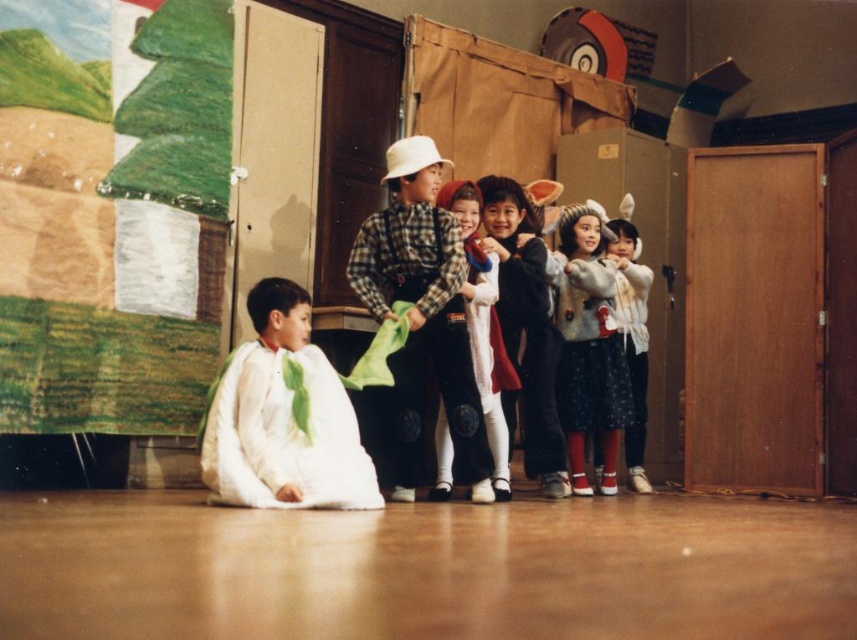
Consider the image. You are standing at point (590, 234) and want to reach the door located at point 0.690, 0.366. Can you walk straight to the door without moving sideways?

The distance between point (590, 234) and the door at 0.690, 0.366 is 4.75 meters. Since there is no mention of obstacles, you can walk straight to the door without moving sideways.